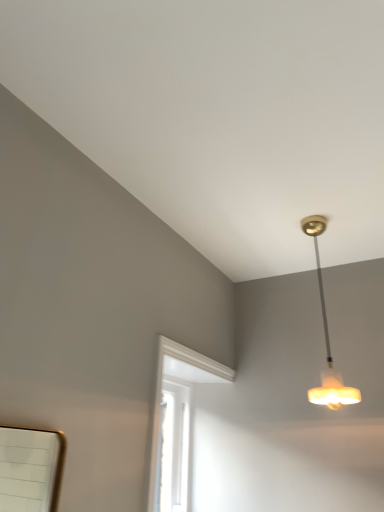
Question: Does white painted wood window at center turn towards translucent glass pendant light at upper right?

Choices:
 (A) no
 (B) yes

Answer: (B)

Question: Is white painted wood window at center smaller than translucent glass pendant light at upper right?

Choices:
 (A) yes
 (B) no

Answer: (B)

Question: From the image's perspective, is white painted wood window at center located above translucent glass pendant light at upper right?

Choices:
 (A) yes
 (B) no

Answer: (B)

Question: Is white painted wood window at center at the right side of translucent glass pendant light at upper right?

Choices:
 (A) no
 (B) yes

Answer: (A)

Question: Is white painted wood window at center positioned beyond the bounds of translucent glass pendant light at upper right?

Choices:
 (A) no
 (B) yes

Answer: (B)

Question: Would you say translucent glass pendant light at upper right is part of white painted wood window at center's contents?

Choices:
 (A) no
 (B) yes

Answer: (A)

Question: From the image's perspective, is translucent glass pendant light at upper right below white painted wood window at center?

Choices:
 (A) no
 (B) yes

Answer: (A)

Question: Is translucent glass pendant light at upper right located outside white painted wood window at center?

Choices:
 (A) no
 (B) yes

Answer: (B)

Question: Is the depth of translucent glass pendant light at upper right greater than that of white painted wood window at center?

Choices:
 (A) yes
 (B) no

Answer: (A)

Question: Can you confirm if translucent glass pendant light at upper right is positioned to the right of white painted wood window at center?

Choices:
 (A) yes
 (B) no

Answer: (A)

Question: Considering the relative sizes of translucent glass pendant light at upper right and white painted wood window at center in the image provided, is translucent glass pendant light at upper right bigger than white painted wood window at center?

Choices:
 (A) yes
 (B) no

Answer: (B)

Question: Does translucent glass pendant light at upper right have a smaller size compared to white painted wood window at center?

Choices:
 (A) yes
 (B) no

Answer: (A)

Question: In terms of size, does translucent glass pendant light at upper right appear bigger or smaller than white painted wood window at center?

Choices:
 (A) big
 (B) small

Answer: (B)